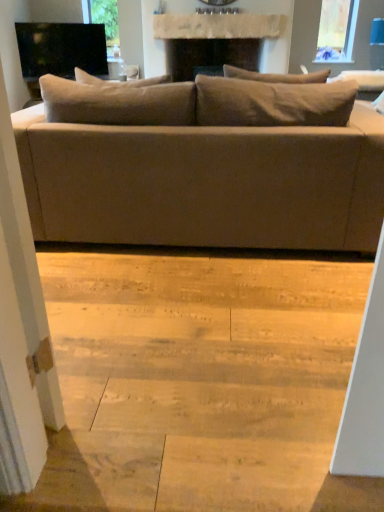
The height and width of the screenshot is (512, 384). Describe the element at coordinates (22, 332) in the screenshot. I see `transparent glass screen door at left` at that location.

Where is `transparent glass screen door at left`? This screenshot has width=384, height=512. transparent glass screen door at left is located at coordinates coord(22,332).

What do you see at coordinates (61, 49) in the screenshot?
I see `black glossy tv at upper left` at bounding box center [61, 49].

The height and width of the screenshot is (512, 384). What are the coordinates of `transparent glass screen door at left` in the screenshot? It's located at (22, 332).

Does point (26, 237) come closer to viewer compared to point (262, 468)?

Yes, point (26, 237) is closer to viewer.

Does transparent glass screen door at left turn towards natural wood stair at lower center?

Yes, transparent glass screen door at left is facing natural wood stair at lower center.

Would you say transparent glass screen door at left is inside or outside natural wood stair at lower center?

transparent glass screen door at left is not inside natural wood stair at lower center, it's outside.

From the image's perspective, is transparent glass screen door at left beneath natural wood stair at lower center?

No, from the image's perspective, transparent glass screen door at left is not below natural wood stair at lower center.

Is black glossy tv at upper left not within transparent glass screen door at left?

Yes.

What's the angular difference between black glossy tv at upper left and transparent glass screen door at left's facing directions?

133 degrees separate the facing orientations of black glossy tv at upper left and transparent glass screen door at left.

Is point (61, 39) farther from camera compared to point (38, 408)?

That is True.

Which is more to the right, black glossy tv at upper left or transparent glass screen door at left?

transparent glass screen door at left is more to the right.

Considering the relative sizes of matte beige couch at center and black glossy tv at upper left in the image provided, is matte beige couch at center wider than black glossy tv at upper left?

Correct, the width of matte beige couch at center exceeds that of black glossy tv at upper left.

Could you tell me if matte beige couch at center is turned towards black glossy tv at upper left?

No, matte beige couch at center does not turn towards black glossy tv at upper left.

Would you say matte beige couch at center is inside or outside black glossy tv at upper left?

matte beige couch at center exists outside the volume of black glossy tv at upper left.

Is the position of natural wood stair at lower center more distant than that of transparent glass screen door at left?

Yes, natural wood stair at lower center is further from the viewer.

Based on the photo, considering the relative positions of natural wood stair at lower center and transparent glass screen door at left in the image provided, is natural wood stair at lower center to the left of transparent glass screen door at left from the viewer's perspective?

No.

Is natural wood stair at lower center next to transparent glass screen door at left?

No, natural wood stair at lower center is not with transparent glass screen door at left.

Is natural wood stair at lower center completely or partially outside of transparent glass screen door at left?

Yes, natural wood stair at lower center is located beyond the bounds of transparent glass screen door at left.

Are matte beige couch at center and natural wood stair at lower center making contact?

No, matte beige couch at center is not with natural wood stair at lower center.

From the picture: Can you confirm if matte beige couch at center is taller than natural wood stair at lower center?

Correct, matte beige couch at center is much taller as natural wood stair at lower center.

Between matte beige couch at center and natural wood stair at lower center, which one appears on the left side from the viewer's perspective?

From the viewer's perspective, natural wood stair at lower center appears more on the left side.

Is matte beige couch at center smaller than natural wood stair at lower center?

Incorrect, matte beige couch at center is not smaller in size than natural wood stair at lower center.

From the image's perspective, which is above, matte beige couch at center or transparent glass screen door at left?

matte beige couch at center, from the image's perspective.

Is matte beige couch at center looking in the opposite direction of transparent glass screen door at left?

matte beige couch at center is not turned away from transparent glass screen door at left.

Which object is further away from the camera, matte beige couch at center or transparent glass screen door at left?

matte beige couch at center is further from the camera.

Identify the location of screen door that appears above the matte beige couch at center (from a real-world perspective). (22, 332).

Does point (323, 376) come farther from viewer compared to point (28, 49)?

No.

Consider the image. From a real-world perspective, which is physically above, natural wood stair at lower center or black glossy tv at upper left?

black glossy tv at upper left.

Is natural wood stair at lower center closer to the viewer compared to black glossy tv at upper left?

Yes, the depth of natural wood stair at lower center is less than that of black glossy tv at upper left.

Find the location of a particular element. The image size is (384, 512). screen door lying above the natural wood stair at lower center (from the image's perspective) is located at coordinates (22, 332).

Locate an element on the screen. screen door below the black glossy tv at upper left (from a real-world perspective) is located at coordinates (22, 332).

From the image, which object appears to be farther from black glossy tv at upper left, matte beige couch at center or natural wood stair at lower center?

natural wood stair at lower center lies further to black glossy tv at upper left than the other object.

From the image, which object appears to be farther from transparent glass screen door at left, natural wood stair at lower center or matte beige couch at center?

matte beige couch at center.

From the image, which object appears to be farther from matte beige couch at center, black glossy tv at upper left or natural wood stair at lower center?

Among the two, black glossy tv at upper left is located further to matte beige couch at center.

In the scene shown: Which object lies further to the anchor point transparent glass screen door at left, black glossy tv at upper left or matte beige couch at center?

Based on the image, black glossy tv at upper left appears to be further to transparent glass screen door at left.

Which object lies further to the anchor point matte beige couch at center, natural wood stair at lower center or black glossy tv at upper left?

Among the two, black glossy tv at upper left is located further to matte beige couch at center.

Looking at the image, which one is located closer to matte beige couch at center, natural wood stair at lower center or transparent glass screen door at left?

natural wood stair at lower center lies closer to matte beige couch at center than the other object.

From the image, which object appears to be farther from natural wood stair at lower center, matte beige couch at center or transparent glass screen door at left?

Among the two, transparent glass screen door at left is located further to natural wood stair at lower center.

Which object lies nearer to the anchor point black glossy tv at upper left, natural wood stair at lower center or matte beige couch at center?

The object closer to black glossy tv at upper left is matte beige couch at center.

The image size is (384, 512). I want to click on stair between transparent glass screen door at left and matte beige couch at center in the front-back direction, so click(x=200, y=381).

Identify the location of studio couch between transparent glass screen door at left and black glossy tv at upper left in the front-back direction. (203, 164).

The height and width of the screenshot is (512, 384). What are the coordinates of `stair between transparent glass screen door at left and black glossy tv at upper left along the z-axis` in the screenshot? It's located at (200, 381).

Identify the location of studio couch between natural wood stair at lower center and black glossy tv at upper left along the z-axis. (203, 164).